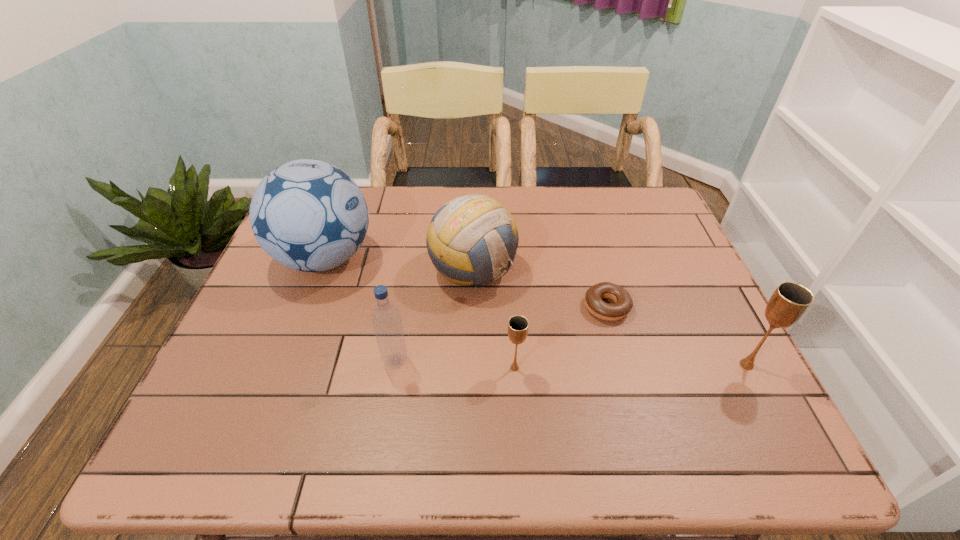
Where is `vacant space that satisfies the following two spatial constraints: 1. on the back side of the shortest object; 2. on the side with brand of the tallest object`? The height and width of the screenshot is (540, 960). vacant space that satisfies the following two spatial constraints: 1. on the back side of the shortest object; 2. on the side with brand of the tallest object is located at coordinates (593, 259).

This screenshot has height=540, width=960. What are the coordinates of `vacant space that satisfies the following two spatial constraints: 1. on the side with brand of the soccer ball; 2. on the right side of the shorter chalice` in the screenshot? It's located at (283, 368).

This screenshot has height=540, width=960. I want to click on vacant region that satisfies the following two spatial constraints: 1. on the side with brand of the soccer ball; 2. on the right side of the shorter chalice, so click(x=283, y=368).

The width and height of the screenshot is (960, 540). I want to click on vacant area that satisfies the following two spatial constraints: 1. on the side with brand of the leftmost object; 2. on the left side of the fifth tallest object, so click(283, 368).

Locate an element on the screen. This screenshot has width=960, height=540. vacant point that satisfies the following two spatial constraints: 1. on the front side of the left chalice; 2. on the right side of the volleyball is located at coordinates (471, 368).